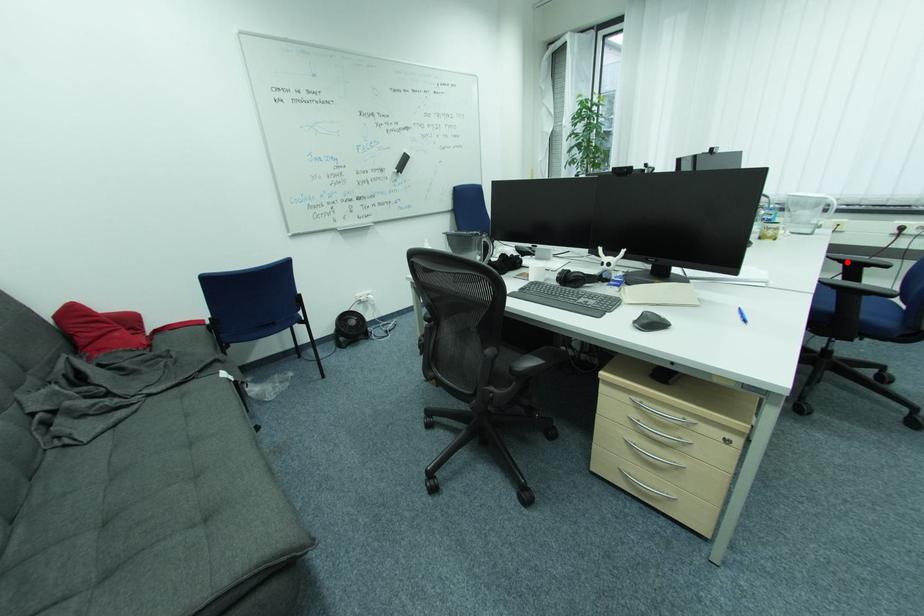
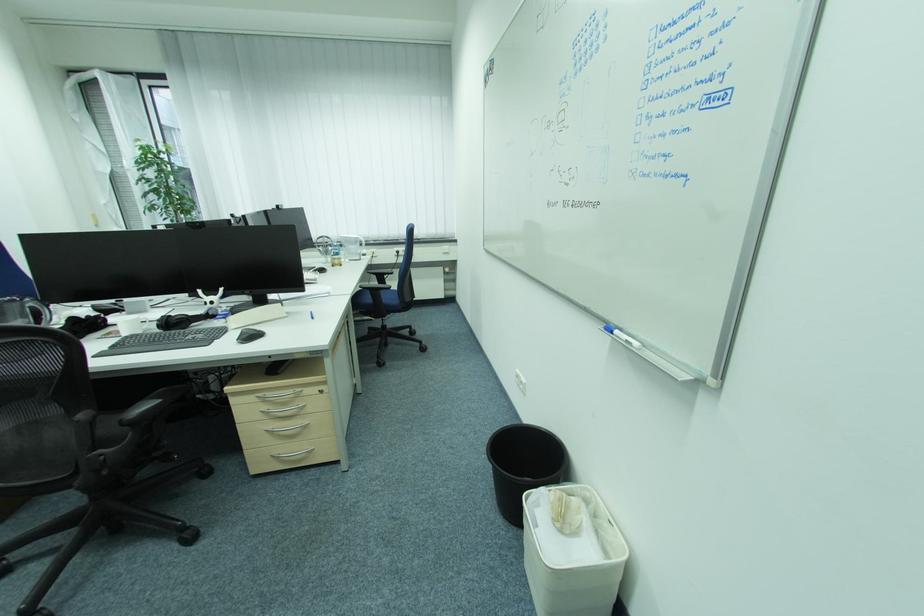
Question: I am providing you with two images of the same scene from different viewpoints. In image1, a red point is highlighted. Considering the same 3D point in image2, which of the following is correct?

Choices:
 (A) It is closer
 (B) It is farther

Answer: (A)